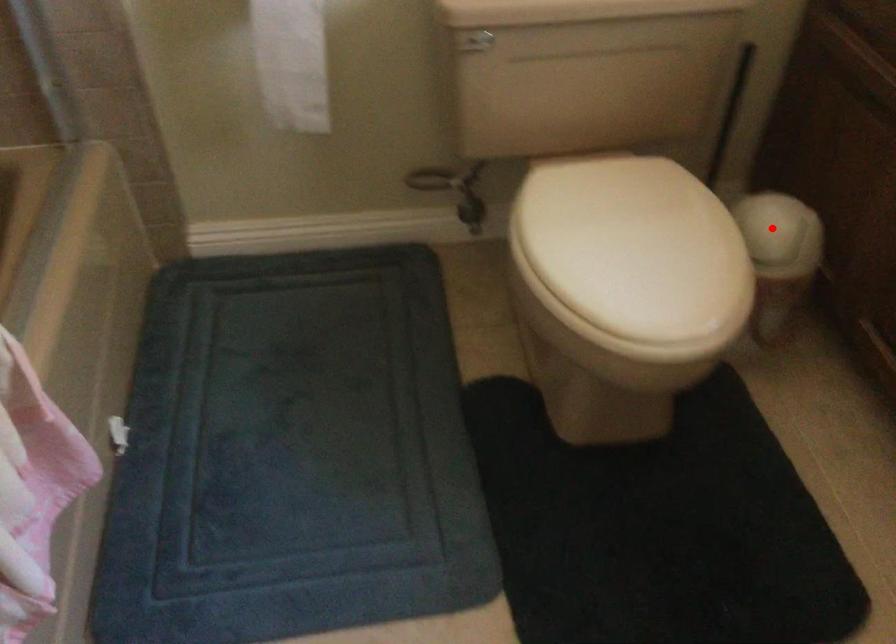
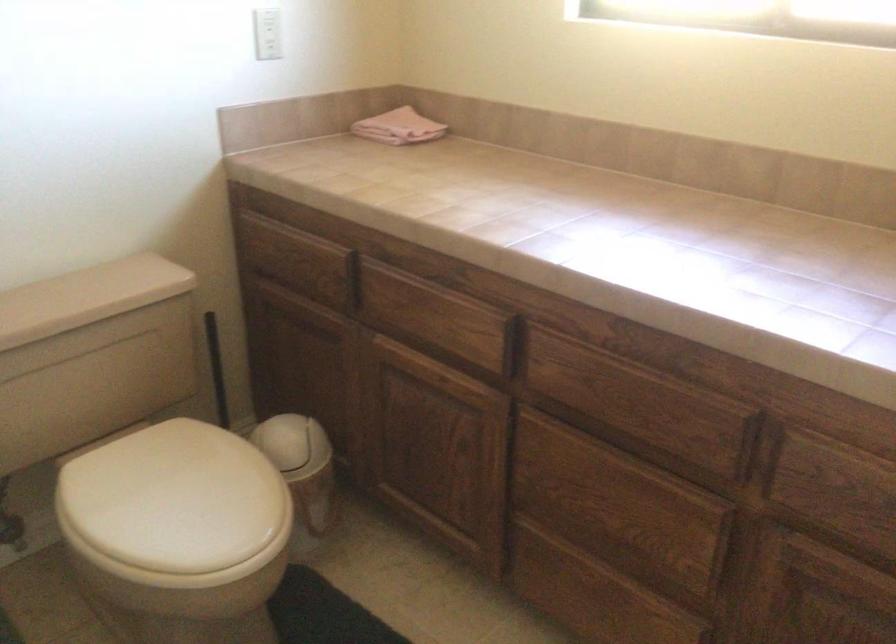
Question: I am providing you with two images of the same scene from different viewpoints. A red point is shown in image1. For the corresponding object point in image2, is it positioned nearer or farther from the camera?

Choices:
 (A) Nearer
 (B) Farther

Answer: (B)